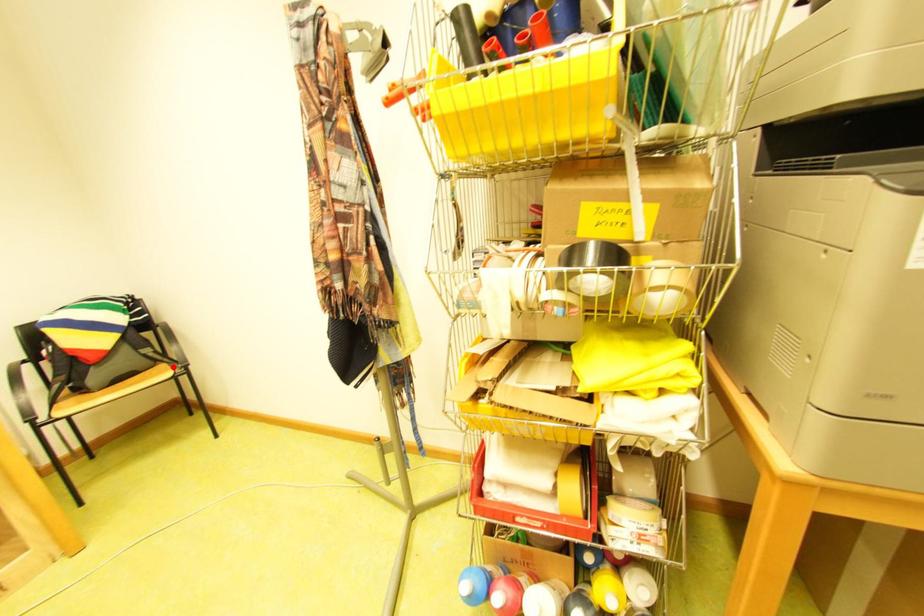
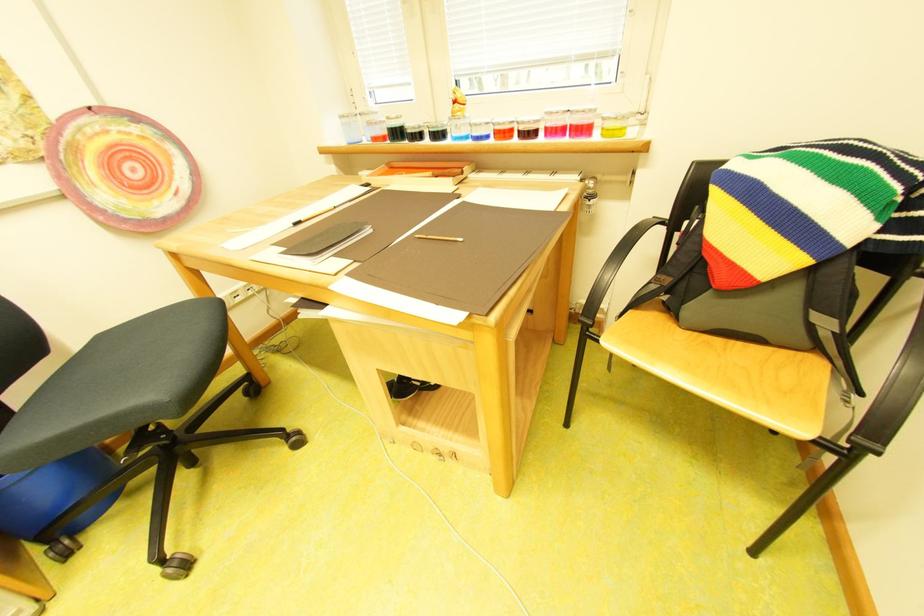
Where in the second image is the point corresponding to the highlighted location from the first image?

(829, 367)